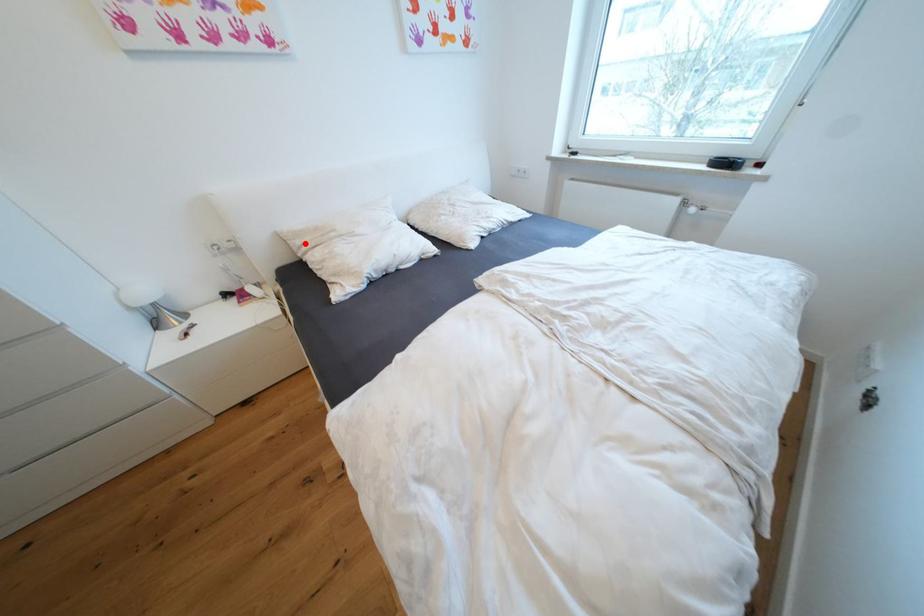
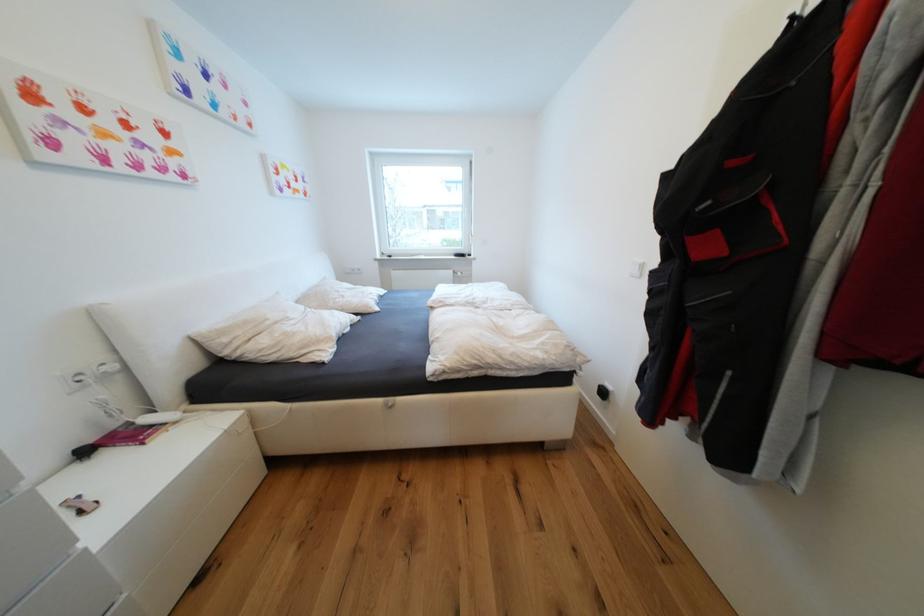
In the second image, find the point that corresponds to the highlighted location in the first image.

(233, 341)